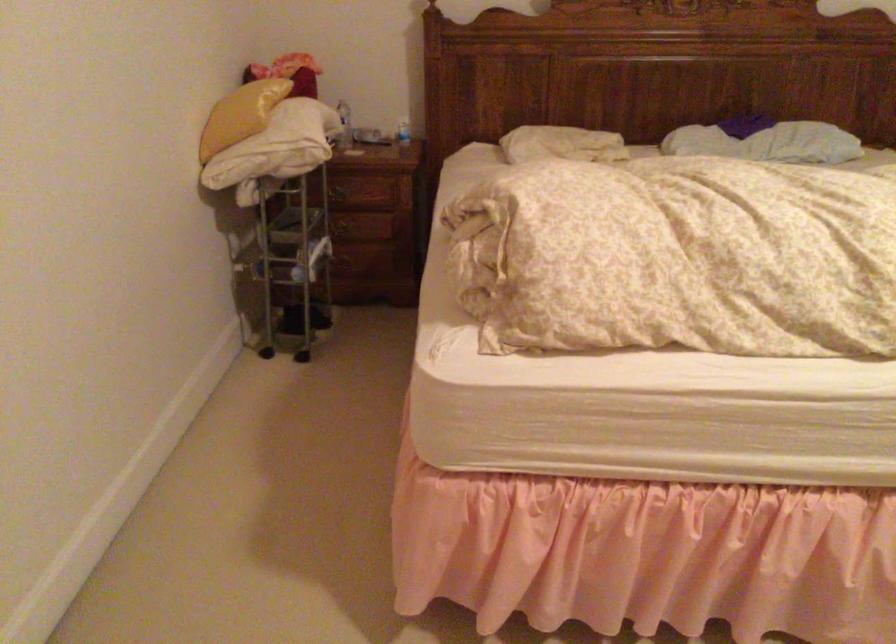
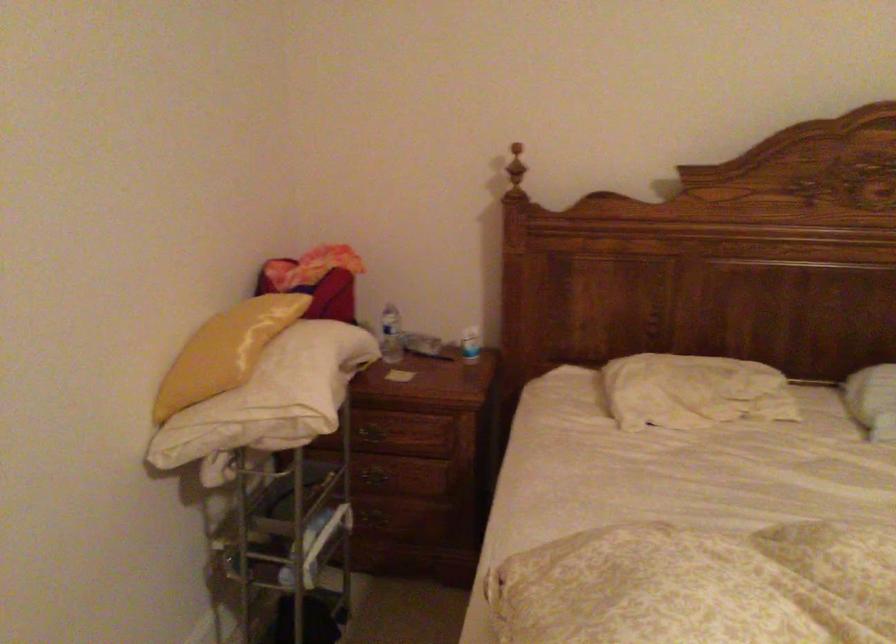
In the second image, find the point that corresponds to the point at 350,257 in the first image.

(381, 516)